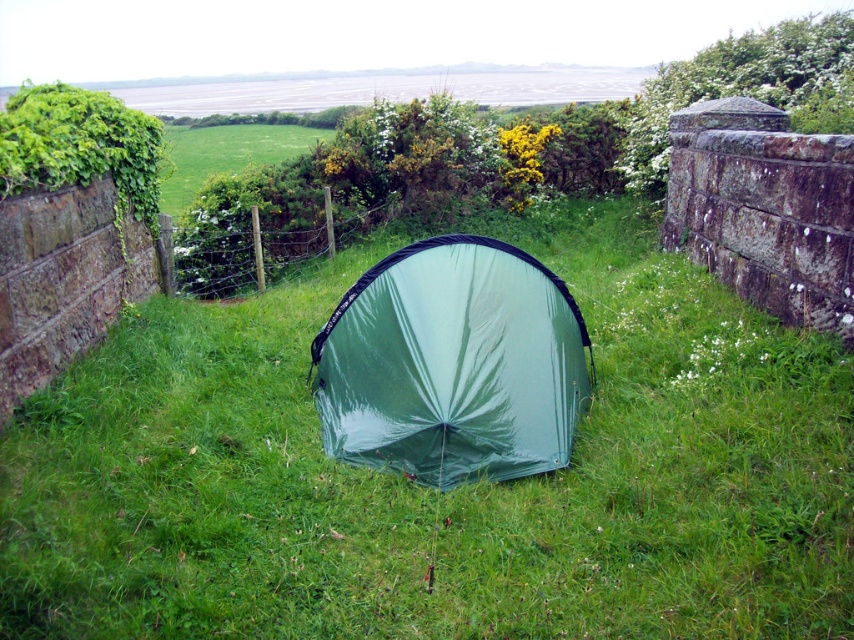
Question: Which object appears closest to the camera in this image?

Choices:
 (A) green grassy field at center
 (B) green fabric tent at center

Answer: (B)

Question: Which point appears closest to the camera in this image?

Choices:
 (A) (254, 140)
 (B) (502, 461)

Answer: (B)

Question: Which object is the farthest from the green fabric tent at center?

Choices:
 (A) green grassy field at center
 (B) green shiny tent at center

Answer: (A)

Question: Can you confirm if green fabric tent at center is positioned to the right of green grassy field at center?

Choices:
 (A) yes
 (B) no

Answer: (A)

Question: Can you confirm if green fabric tent at center is positioned to the left of green shiny tent at center?

Choices:
 (A) no
 (B) yes

Answer: (B)

Question: Is green shiny tent at center wider than green grassy field at center?

Choices:
 (A) yes
 (B) no

Answer: (B)